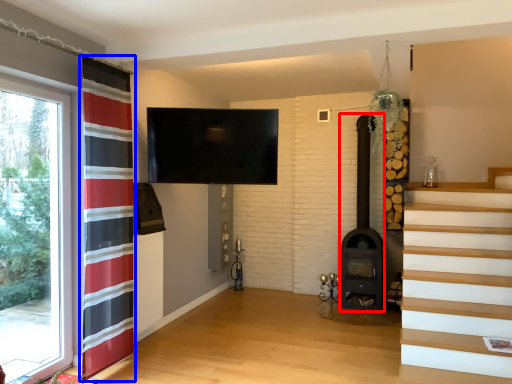
Question: Which object appears closest to the camera in this image, fireplace (highlighted by a red box) or curtain (highlighted by a blue box)?

Choices:
 (A) fireplace
 (B) curtain

Answer: (B)